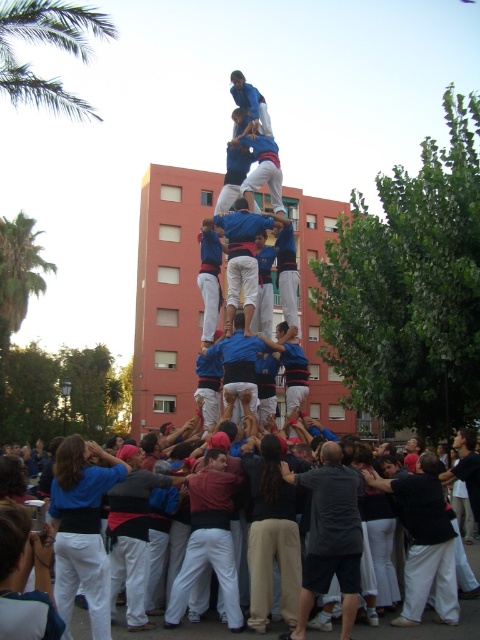
You are a photographer standing in the crowd at the base of the human tower. You want to take a photo that includes both the green leafy palm tree at upper left and the green leafy palm tree at left. Which palm tree will appear wider in the photo?

The green leafy palm tree at upper left will appear wider in the photo because its width is larger than the green leafy palm tree at left.

Looking at this image, you are a photographer standing in the crowd watching the human tower. You want to take a photo that includes both the green leafy palm tree at upper left and the green leafy palm tree at left. Which palm tree will appear taller in the photo?

The green leafy palm tree at upper left will appear taller in the photo because it is taller than the green leafy palm tree at left.

You are a photographer at the event and want to capture a photo of the blue fabric at center and the blue fabric man at center. Which one is positioned higher in the image?

The blue fabric at center is positioned higher than the blue fabric man at center in the image.